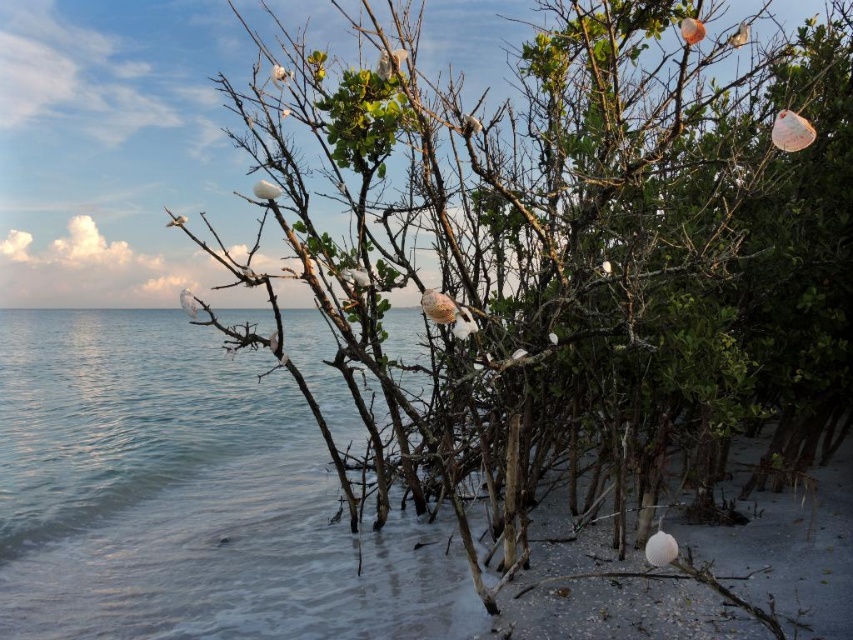
Does white matte shell at upper center appear on the left side of white fluffy bird at center?

Yes, white matte shell at upper center is to the left of white fluffy bird at center.

Is point (254, 186) behind point (364, 276)?

No.

You are a GUI agent. You are given a task and a screenshot of the screen. Output one action in this format:
    pyautogui.click(x=<x>, y=<y>)
    Task: Click on the white matte shell at upper center
    
    Given the screenshot: What is the action you would take?
    pyautogui.click(x=265, y=189)

Can you confirm if brown feathered bird at center is positioned to the left of white matte seashell at center?

No, brown feathered bird at center is not to the left of white matte seashell at center.

Which is below, brown feathered bird at center or white matte seashell at center?

Positioned lower is brown feathered bird at center.

Describe the element at coordinates (440, 307) in the screenshot. I see `brown feathered bird at center` at that location.

Locate an element on the screen. This screenshot has width=853, height=640. brown feathered bird at center is located at coordinates (440, 307).

Can you confirm if white matte shell at upper center is bigger than white fluffy bird at upper center?

Yes, white matte shell at upper center is bigger than white fluffy bird at upper center.

Does white matte shell at upper center have a greater height compared to white fluffy bird at upper center?

No.

Who is more distant from viewer, (x=265, y=186) or (x=473, y=125)?

Positioned behind is point (x=265, y=186).

I want to click on white matte shell at upper center, so click(x=265, y=189).